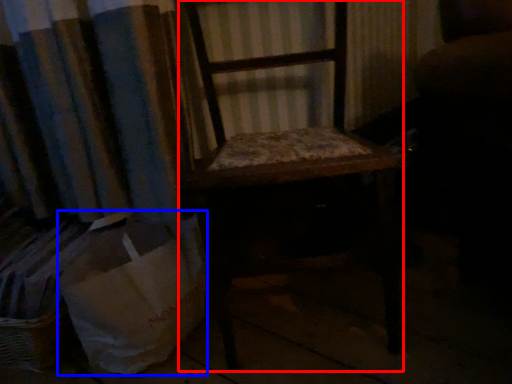
Question: Which object appears closest to the camera in this image, furniture (highlighted by a red box) or shopping bag (highlighted by a blue box)?

Choices:
 (A) furniture
 (B) shopping bag

Answer: (A)